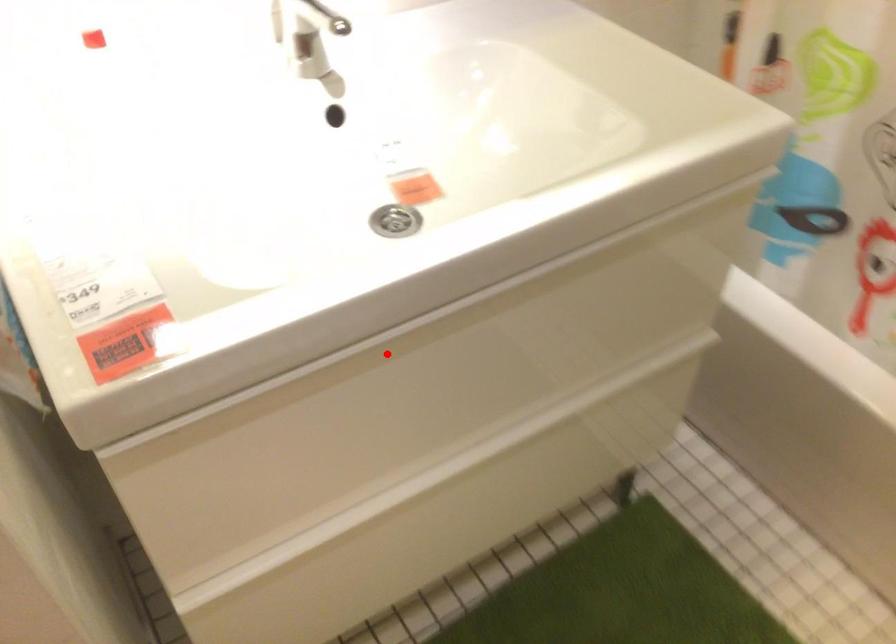
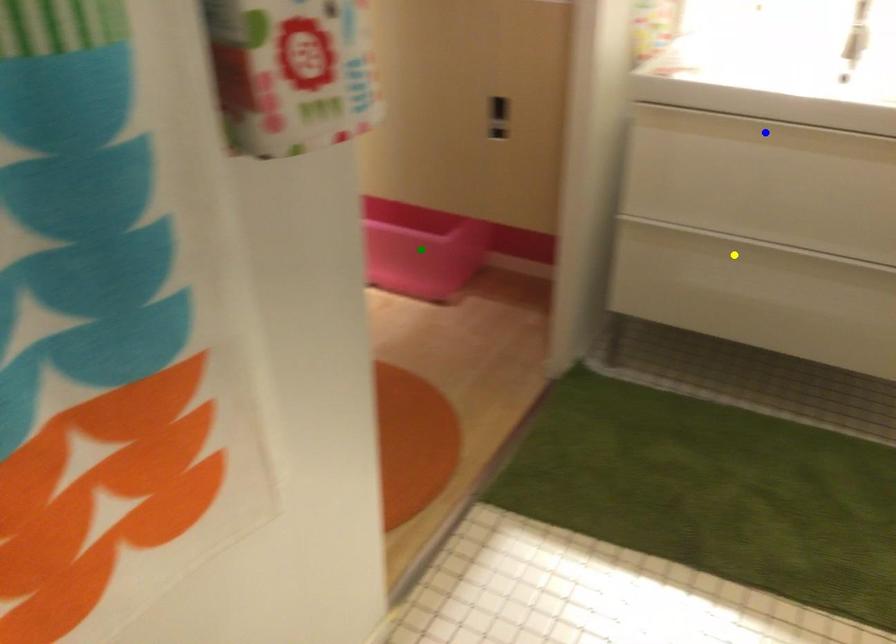
Question: I am providing you with two images of the same scene from different viewpoints. A red point is marked on the first image. You are given multiple points on the second image. Which point in image 2 is actually the same real-world point as the red point in image 1?

Choices:
 (A) green point
 (B) yellow point
 (C) blue point

Answer: (C)